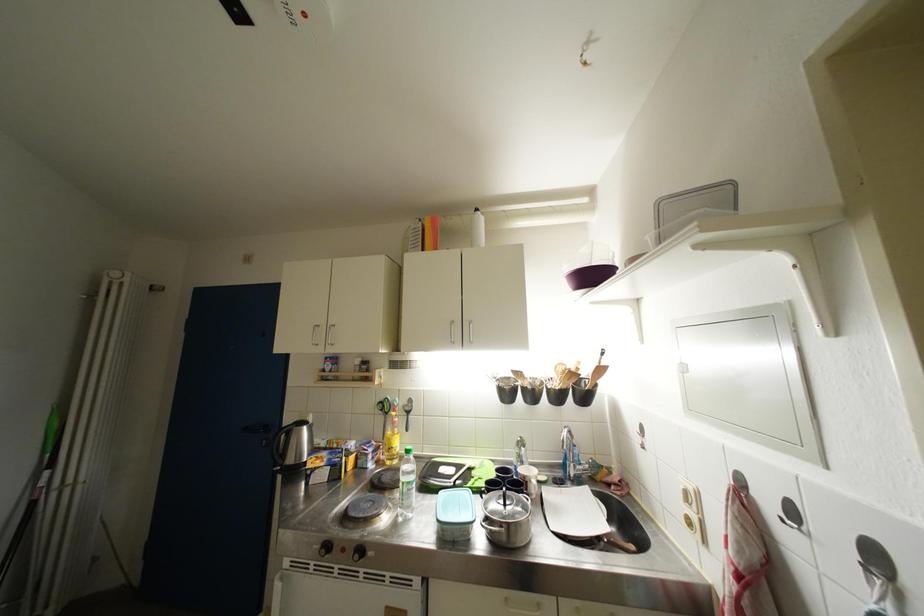
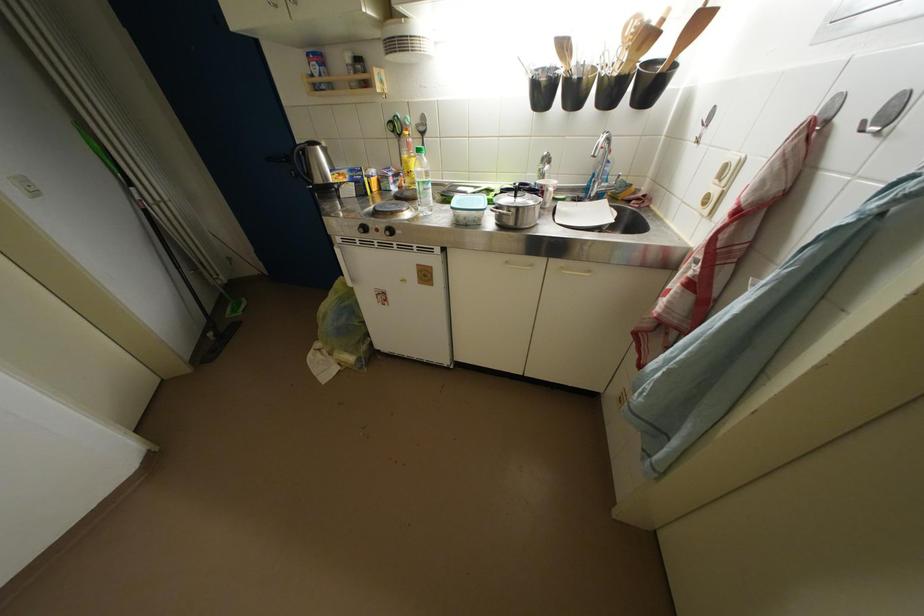
The point at (641, 440) is marked in the first image. Where is the corresponding point in the second image?

(700, 137)